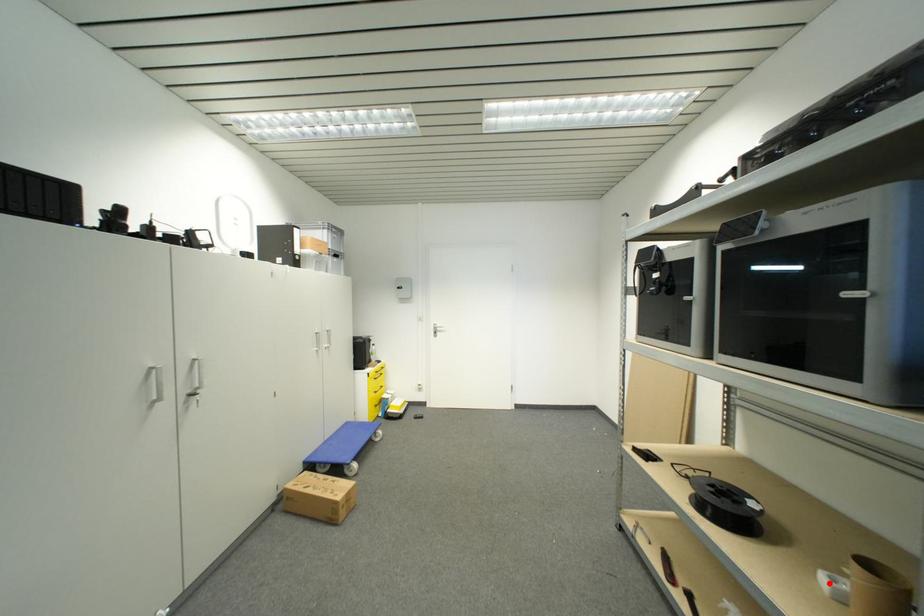
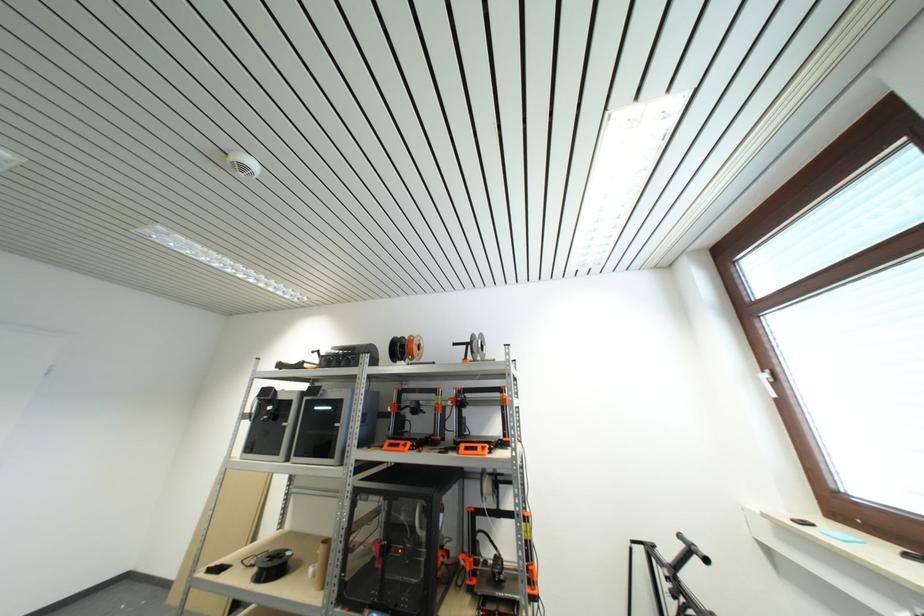
Locate, in the second image, the point that corresponds to the highlighted location in the first image.

(314, 573)